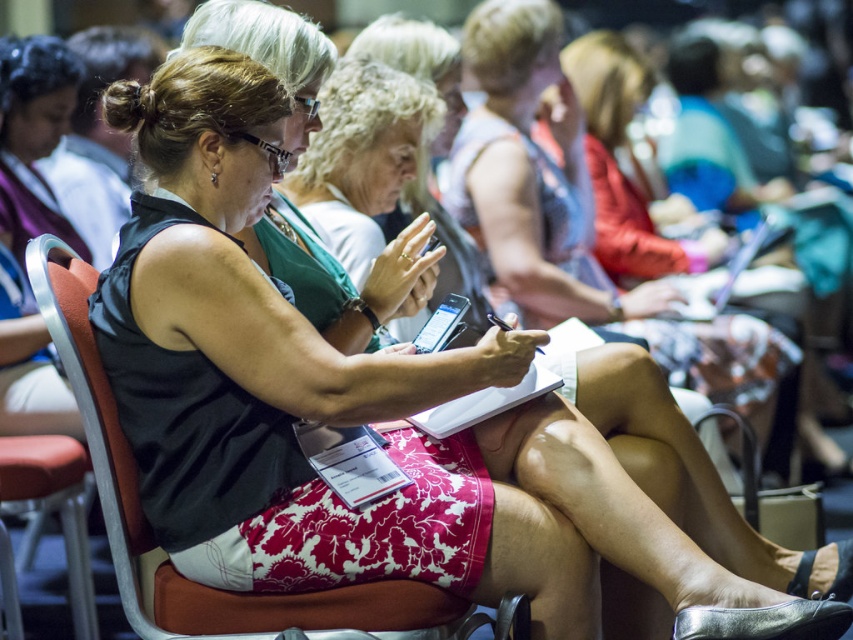
You are standing in the conference room and want to locate the pink floral skirt at center. According to the coordinate system where the bottom left corner is the origin, can you confirm if the skirt is positioned to the left or right side of the room?

The pink floral skirt at center is located at coordinates approximately 0.273 on the x axis and 0.625 on the y axis. Since the x coordinate is less than 0.5, it is positioned to the left side of the room.

You are an event organizer and need to ensure that the seating arrangement allows attendees to see the front stage clearly. The pink floral skirt at center and red fabric chair at center are in the front row. From the perspective of someone sitting behind them, which object would block their view more?

The pink floral skirt at center is to the right of the red fabric chair at center, so if you are sitting behind them, the red fabric chair at center would block your view more since it is positioned to the left of the skirt and thus closer to the center line, potentially obstructing a wider field of vision.

You are sitting in the front row of the conference hall and see the pink floral skirt at center and the red fabric chair at center. Which object is closer to you?

The pink floral skirt at center is closer to you because the red fabric chair at center is behind it.